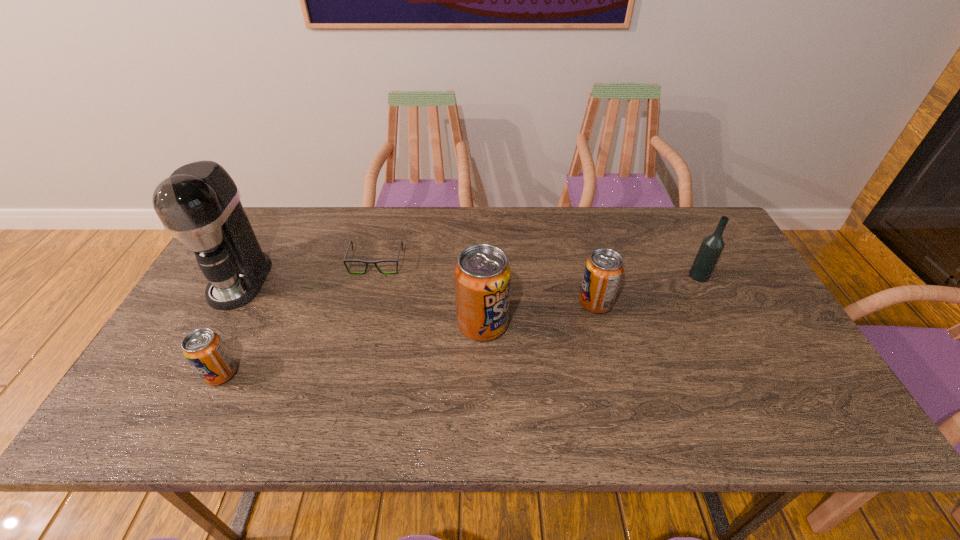
Locate an element on the screen. The height and width of the screenshot is (540, 960). object situated at the right edge is located at coordinates (712, 246).

Identify the location of object located at the near left corner. (204, 349).

Image resolution: width=960 pixels, height=540 pixels. In order to click on vacant space at the far edge of the desktop in this screenshot , I will do `click(529, 231)`.

Locate an element on the screen. The image size is (960, 540). vacant area at the right edge of the desktop is located at coordinates (739, 273).

What are the coordinates of `free spot at the far left corner of the desktop` in the screenshot? It's located at (279, 249).

The width and height of the screenshot is (960, 540). In order to click on vacant space at the near right corner of the desktop in this screenshot , I will do `click(801, 397)`.

Where is `free space between the third object from right to left and the nearest object`? This screenshot has height=540, width=960. free space between the third object from right to left and the nearest object is located at coordinates (351, 349).

Where is `unoccupied position between the second object from right to left and the vodka`? The width and height of the screenshot is (960, 540). unoccupied position between the second object from right to left and the vodka is located at coordinates (647, 289).

This screenshot has width=960, height=540. I want to click on vacant space in between the coffee maker and the fifth object from left to right, so point(418,292).

Image resolution: width=960 pixels, height=540 pixels. I want to click on vacant area that lies between the fifth object from left to right and the coffee maker, so click(418, 292).